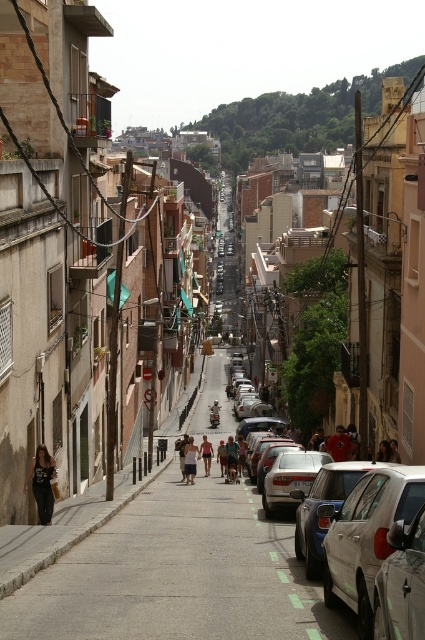
Question: Is dark gray fabric pants at lower left below tan fabric shorts at center?

Choices:
 (A) no
 (B) yes

Answer: (A)

Question: Can you confirm if metallic silver car at center is wider than dark blue jeans at center?

Choices:
 (A) yes
 (B) no

Answer: (B)

Question: Can you confirm if green leafy hillside at upper center is bigger than white cotton shorts at center?

Choices:
 (A) no
 (B) yes

Answer: (B)

Question: Based on their relative distances, which object is farther from the satin white car at right?

Choices:
 (A) dark gray fabric pants at lower left
 (B) silver metallic car at right
 (C) green leafy hillside at upper center

Answer: (C)

Question: Considering the real-world distances, which object is closest to the satin white car at right?

Choices:
 (A) green leafy hillside at upper center
 (B) tan cotton shorts at center

Answer: (B)

Question: Which object is positioned farthest from the satin white car at right?

Choices:
 (A) silver metallic car at center
 (B) green leafy hillside at upper center

Answer: (B)